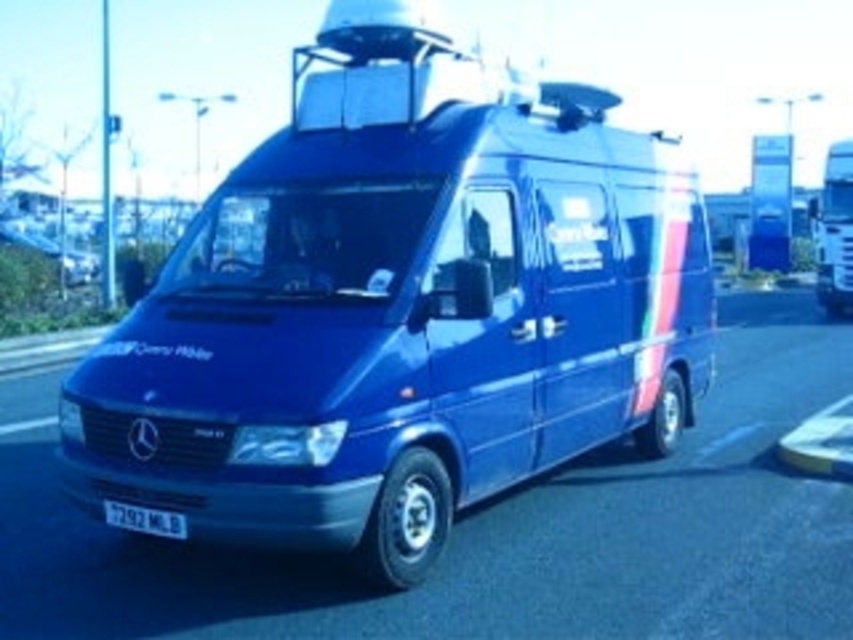
You are standing at the origin point in the image coordinate system. Where is the glossy blue van at center located in terms of coordinates?

The glossy blue van at center is located at coordinates point (402, 307).

You are standing in front of a blue Mercedes van parked outside. There is a point marked at coordinates [496,531]. Based on the scene description, can you identify what this point is marking?

The point at coordinates [496,531] marks the location of the metallic blue van at center.